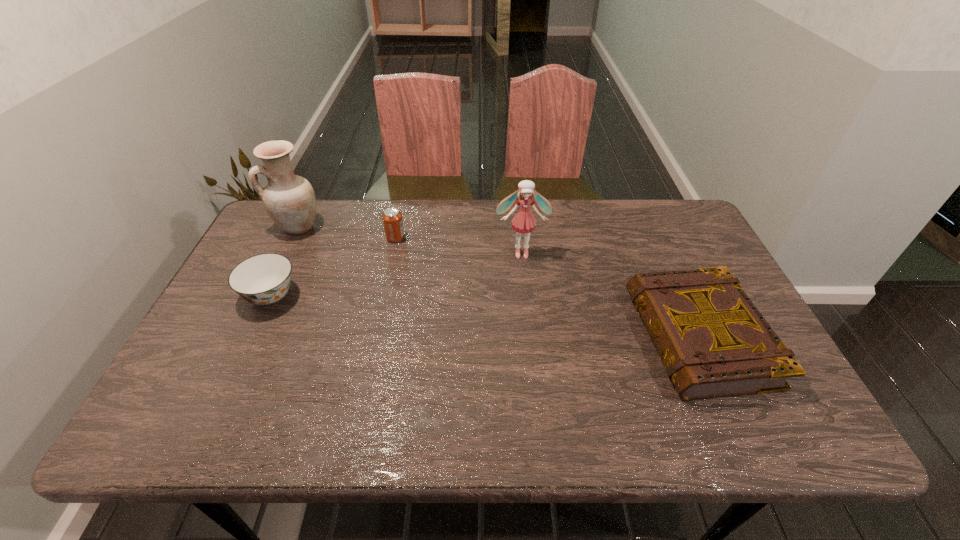
What are the coordinates of `pottery` in the screenshot? It's located at (289, 199).

Image resolution: width=960 pixels, height=540 pixels. What are the coordinates of `doll` in the screenshot? It's located at (523, 221).

You are a GUI agent. You are given a task and a screenshot of the screen. Output one action in this format:
    pyautogui.click(x=<x>, y=<y>)
    Task: Click on the fourth object from left to right
    This screenshot has width=960, height=540.
    Given the screenshot: What is the action you would take?
    pyautogui.click(x=523, y=221)

Identify the location of can. Image resolution: width=960 pixels, height=540 pixels. (392, 218).

Where is `soup bowl`? This screenshot has width=960, height=540. soup bowl is located at coordinates (264, 279).

Find the location of a particular element. The image size is (960, 540). hardback book is located at coordinates (713, 342).

The height and width of the screenshot is (540, 960). In order to click on free spot located 0.400m on the front of the pottery in this screenshot , I will do [x=240, y=346].

Where is `free location located on the front-facing side of the doll`? Image resolution: width=960 pixels, height=540 pixels. free location located on the front-facing side of the doll is located at coordinates (527, 303).

At what (x,y) coordinates should I click in order to perform the action: click on vacant space situated 0.290m on the right of the can. Please return your answer as a coordinate pair (x, y). This screenshot has width=960, height=540. Looking at the image, I should click on (498, 238).

Locate an element on the screen. free space located 0.230m on the right of the soup bowl is located at coordinates (384, 295).